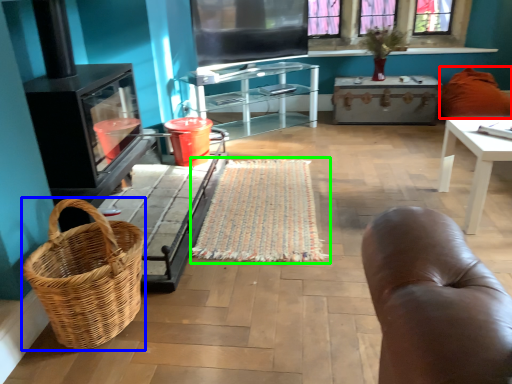
Question: Based on their relative distances, which object is farther from pillow (highlighted by a red box)? Choose from picnic basket (highlighted by a blue box) and mat (highlighted by a green box).

Choices:
 (A) picnic basket
 (B) mat

Answer: (A)